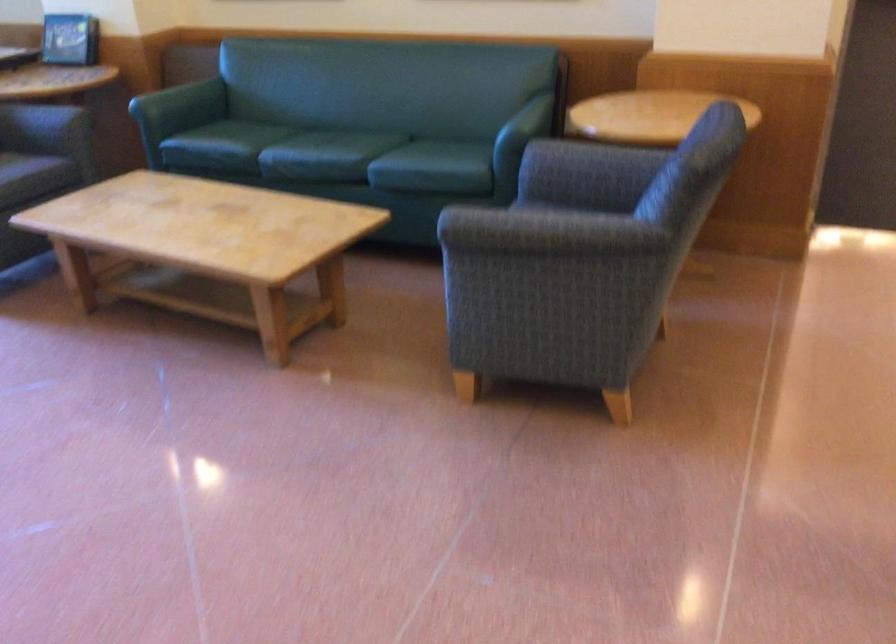
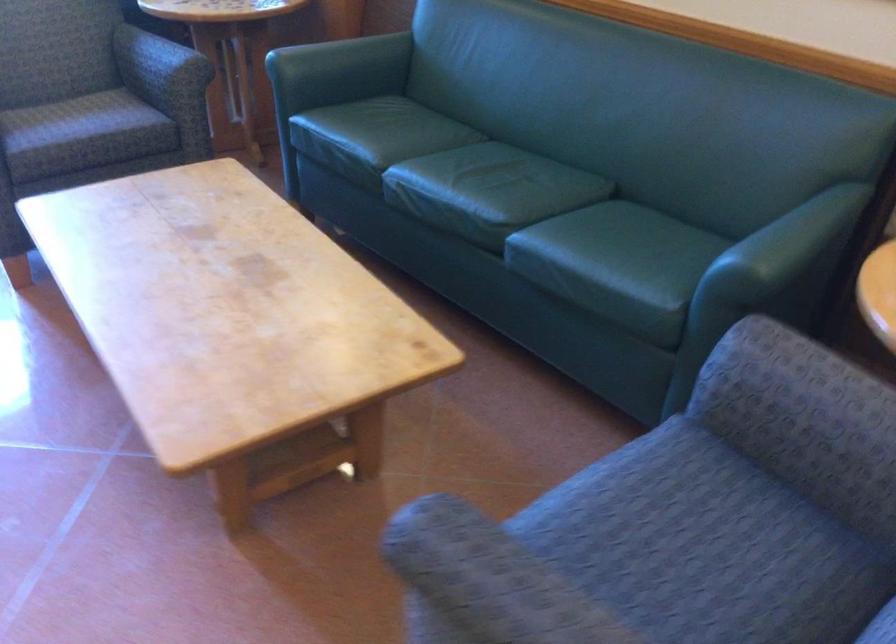
Where in the second image is the point corresponding to point 237,137 from the first image?

(374, 137)